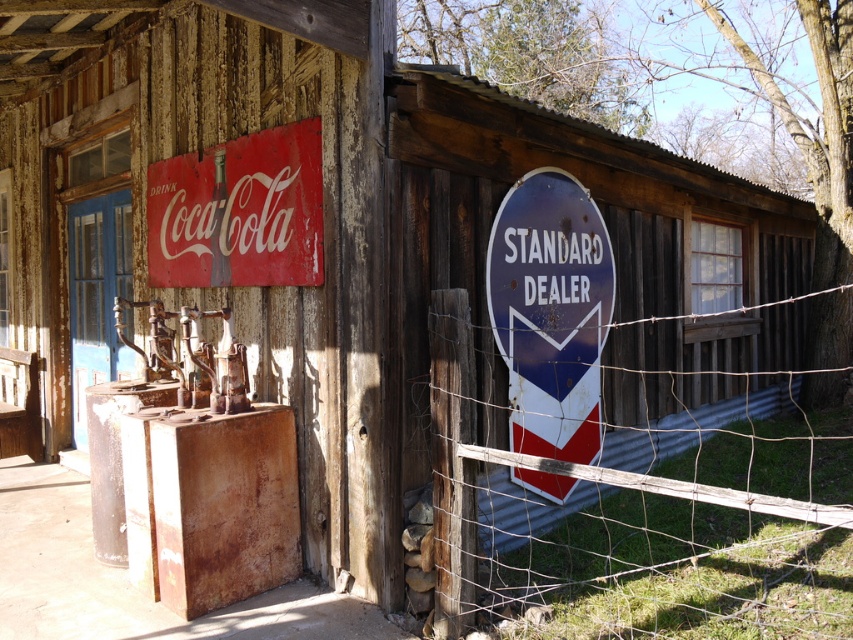
Question: Which of the following is the farthest from the observer?

Choices:
 (A) (534, 362)
 (B) (270, 179)

Answer: (A)

Question: Which object appears closest to the camera in this image?

Choices:
 (A) wire mesh at right
 (B) red matte coca-cola sign at upper left

Answer: (A)

Question: Can you confirm if wire mesh at right is positioned above metallic blue sign at right?

Choices:
 (A) yes
 (B) no

Answer: (B)

Question: Is metallic blue sign at right positioned at the back of red matte coca-cola sign at upper left?

Choices:
 (A) yes
 (B) no

Answer: (A)

Question: Does wire mesh at right appear on the right side of red matte coca-cola sign at upper left?

Choices:
 (A) yes
 (B) no

Answer: (A)

Question: Estimate the real-world distances between objects in this image. Which object is farther from the wire mesh at right?

Choices:
 (A) metallic blue sign at right
 (B) red matte coca-cola sign at upper left

Answer: (B)